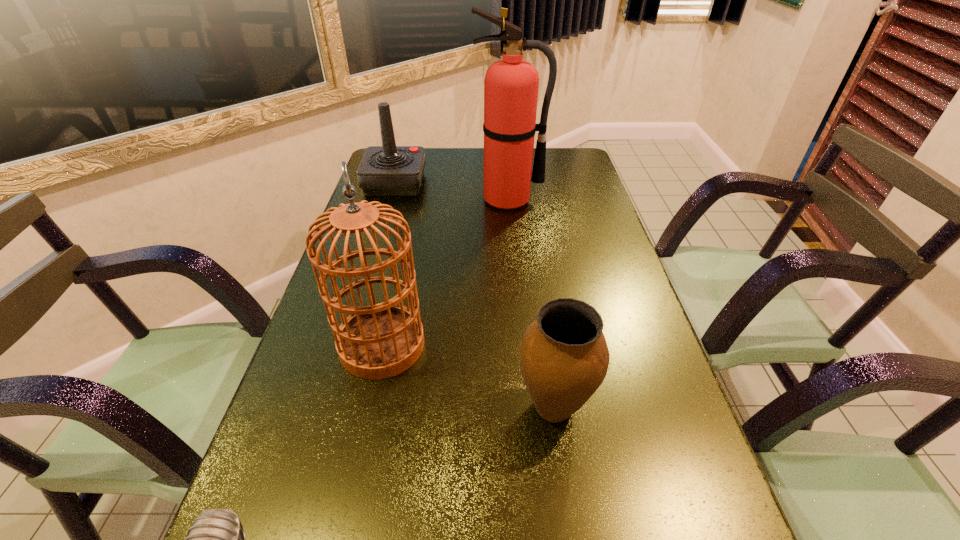
You are a GUI agent. You are given a task and a screenshot of the screen. Output one action in this format:
    pyautogui.click(x=<x>, y=<y>)
    Task: Click on the object that is the second closest to the nearest object
    The width and height of the screenshot is (960, 540).
    Given the screenshot: What is the action you would take?
    pyautogui.click(x=564, y=357)

Identify the location of free spot that satisfies the following two spatial constraints: 1. on the front-facing side of the birdcage; 2. on the left side of the joystick. (348, 345).